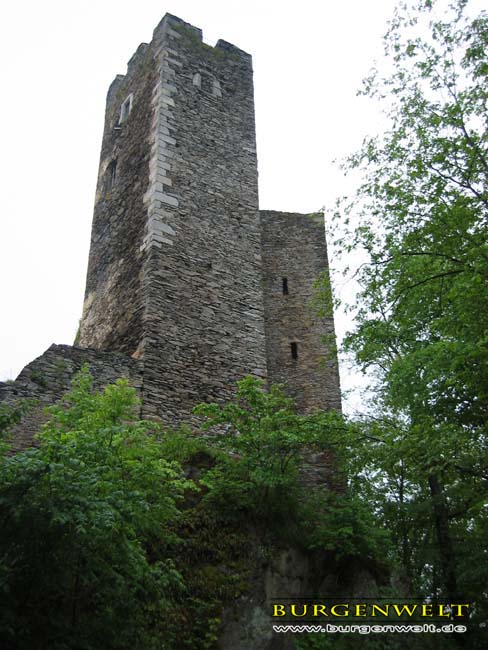
Identify the location of the top edge of wall without "crenels". This screenshot has width=488, height=650. (282, 212).